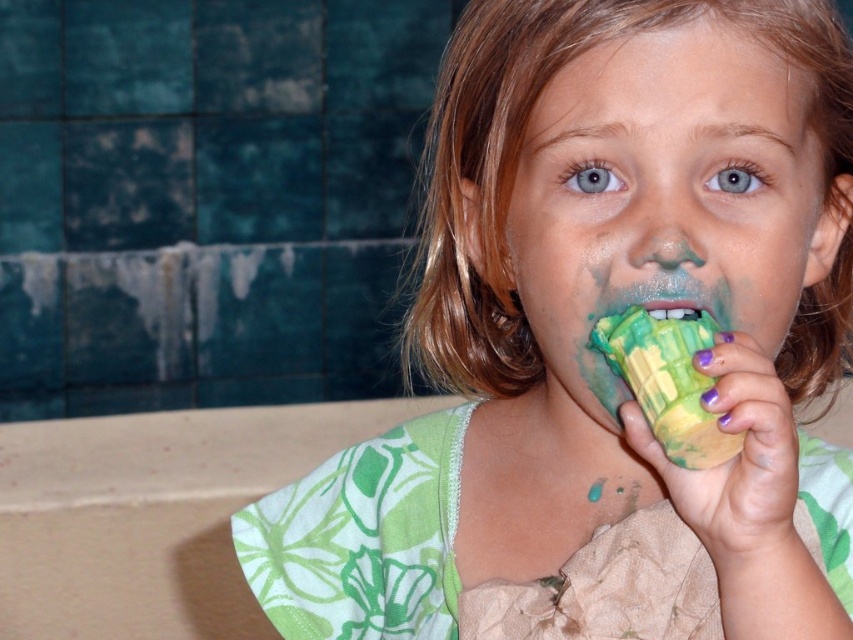
Can you confirm if green matte ice cream cone at center is positioned below green matte ice cream at center?

Yes, green matte ice cream cone at center is below green matte ice cream at center.

Consider the image. Does green matte ice cream cone at center have a greater width compared to green matte ice cream at center?

Yes.

Is point (785, 589) positioned behind point (714, 323)?

No, it is not.

Identify the location of green matte ice cream cone at center. The width and height of the screenshot is (853, 640). (596, 314).

Does green matte ice cream cone at center appear under green rubber toy at mouth?

Actually, green matte ice cream cone at center is above green rubber toy at mouth.

Which of these two, green matte ice cream cone at center or green rubber toy at mouth, stands shorter?

green rubber toy at mouth

Identify the location of green matte ice cream cone at center. (596, 314).

Which of these two, green matte cupcake at center or green matte ice cream at center, stands shorter?

Standing shorter between the two is green matte ice cream at center.

Can you confirm if green matte cupcake at center is bigger than green matte ice cream at center?

Correct, green matte cupcake at center is larger in size than green matte ice cream at center.

Image resolution: width=853 pixels, height=640 pixels. Find the location of `green matte cupcake at center`. green matte cupcake at center is located at coordinates (665, 212).